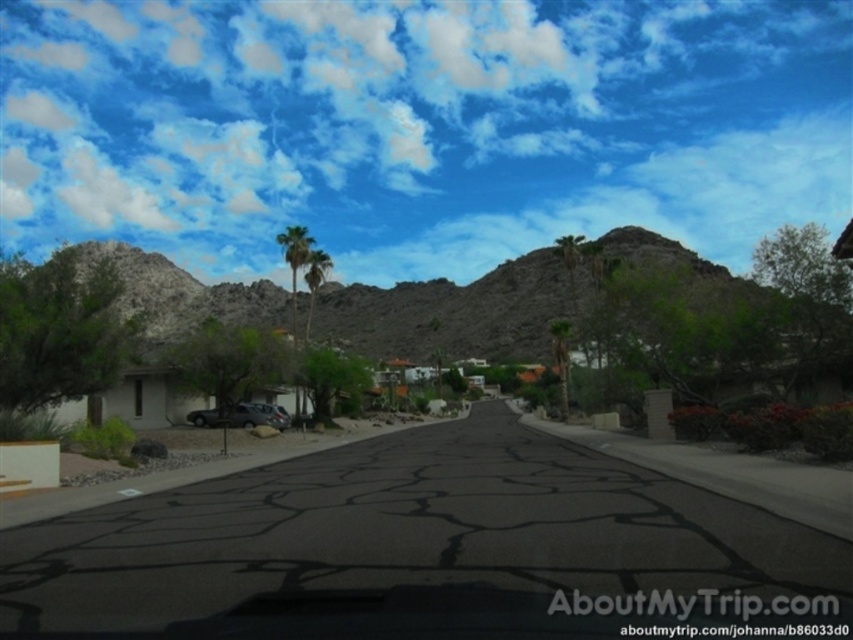
You are a photographer planning to take a picture of the suburban street scene. You want to ensure the white fluffy cloud at upper left and dark gray metallic suv at center are both visible in the frame. Considering their sizes, which object will appear bigger in your photo?

The white fluffy cloud at upper left will appear bigger in the photo because it has a larger size compared to the dark gray metallic suv at center.

You are standing on the suburban street and looking up at the sky. There is a point marked at coordinates [426,124]. What object is this point located on?

The point at [426,124] is located on the white fluffy cloud at upper center.